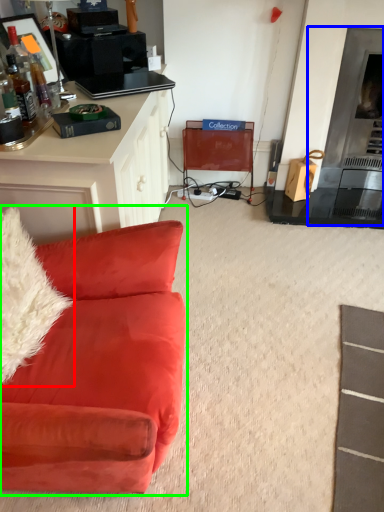
Question: Which is nearer to the pillow (highlighted by a red box)? fireplace (highlighted by a blue box) or studio couch (highlighted by a green box).

Choices:
 (A) fireplace
 (B) studio couch

Answer: (B)